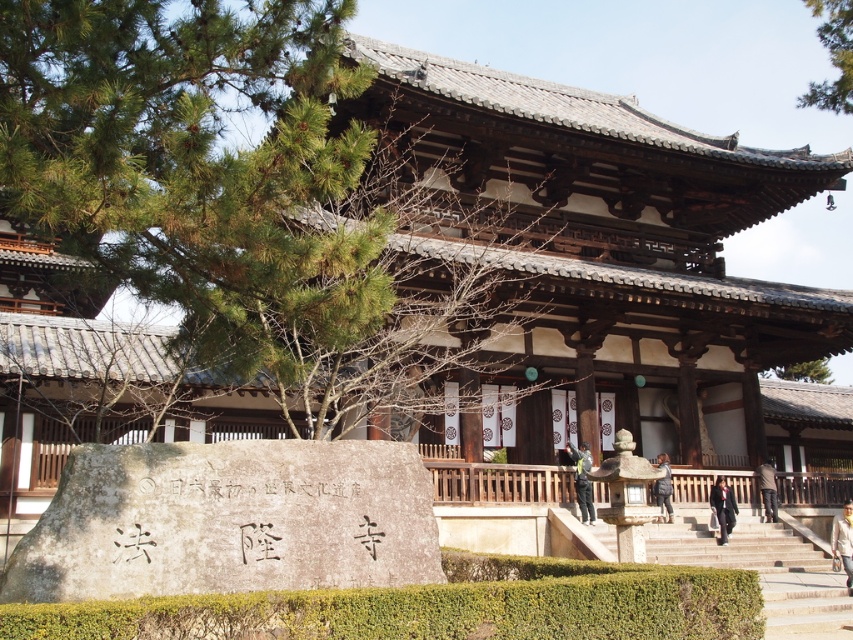
Question: Which point is closer to the camera?

Choices:
 (A) green leafy tree at upper right
 (B) green leafy hedge at lower center
 (C) black quilted jacket at center
 (D) green leafy tree at upper center

Answer: (B)

Question: Can you confirm if light brown leather jacket at lower right is positioned to the left of black fabric coat at center?

Choices:
 (A) yes
 (B) no

Answer: (B)

Question: Does dark green fabric jacket at center come in front of dark brown wood at right?

Choices:
 (A) yes
 (B) no

Answer: (A)

Question: Can you confirm if black fabric coat at center is bigger than dark brown wood at right?

Choices:
 (A) yes
 (B) no

Answer: (A)

Question: Which of the following is the closest to the observer?

Choices:
 (A) green leafy tree at upper center
 (B) green leafy tree at upper right
 (C) black quilted jacket at center
 (D) dark brown wood at right

Answer: (C)

Question: Estimate the real-world distances between objects in this image. Which object is farther from the green leafy tree at upper center?

Choices:
 (A) black quilted jacket at center
 (B) dark green fabric jacket at center

Answer: (A)